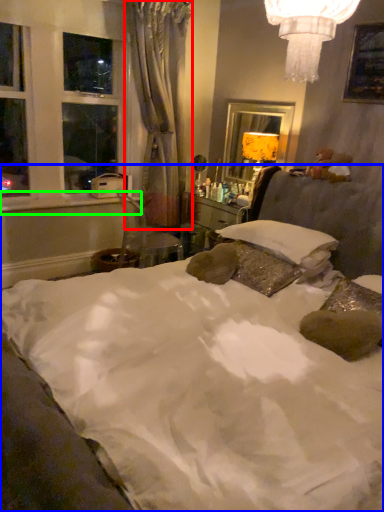
Question: Which is nearer to the curtain (highlighted by a red box)? bed (highlighted by a blue box) or window sill (highlighted by a green box).

Choices:
 (A) bed
 (B) window sill

Answer: (B)